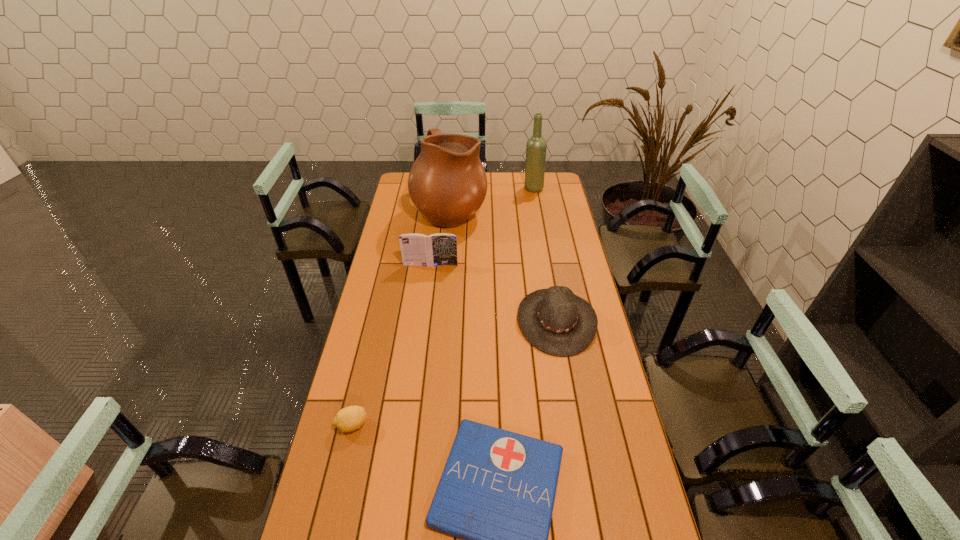
You are a GUI agent. You are given a task and a screenshot of the screen. Output one action in this format:
    pyautogui.click(x=<x>, y=<y>)
    Task: Click on the free point that satisfies the following two spatial constraints: 1. on the front cover of the fourth nearest object; 2. at the stem end of the lemon
    
    Given the screenshot: What is the action you would take?
    [x=410, y=425]

Where is `free space that satisfies the following two spatial constraints: 1. at the spout of the cream pitcher; 2. on the front cover of the fourth shortest object`? This screenshot has height=540, width=960. free space that satisfies the following two spatial constraints: 1. at the spout of the cream pitcher; 2. on the front cover of the fourth shortest object is located at coordinates (445, 265).